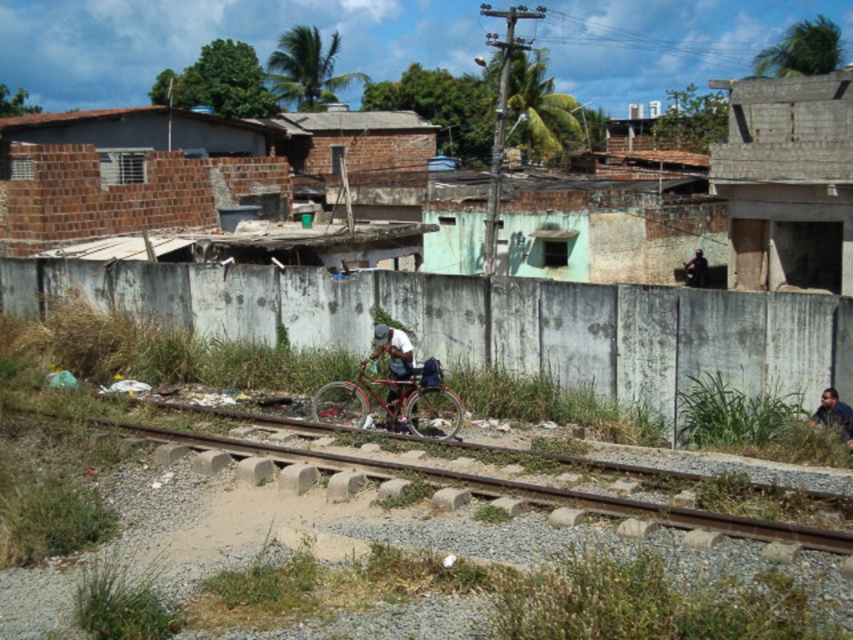
Question: Can you confirm if metallic red bicycle at center is positioned to the left of dark blue fabric shirt at lower right?

Choices:
 (A) no
 (B) yes

Answer: (B)

Question: Can you confirm if metallic bicycle at center is positioned above dark blue fabric shirt at lower right?

Choices:
 (A) no
 (B) yes

Answer: (B)

Question: Among these points, which one is nearest to the camera?

Choices:
 (A) (347, 410)
 (B) (396, 332)

Answer: (B)

Question: Does metallic red bicycle at center have a smaller size compared to dark blue fabric bag at center?

Choices:
 (A) no
 (B) yes

Answer: (A)

Question: Estimate the real-world distances between objects in this image. Which object is closer to the metallic bicycle at center?

Choices:
 (A) metallic red bicycle at center
 (B) dark blue fabric shirt at lower right
 (C) dark blue fabric bag at center

Answer: (A)

Question: Which object is closer to the camera taking this photo?

Choices:
 (A) dark blue fabric bag at center
 (B) metallic red bicycle at center

Answer: (B)